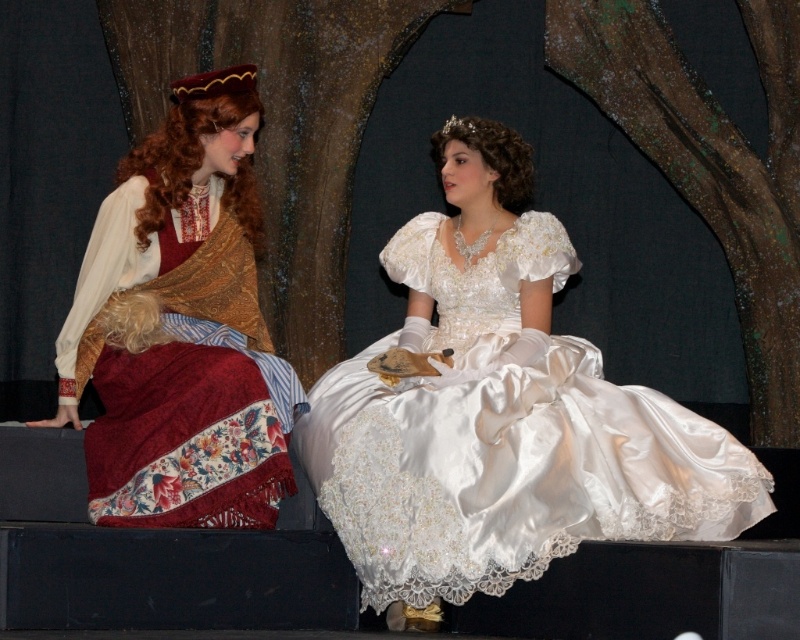
Question: Which of the following is the farthest from the observer?

Choices:
 (A) (448, 404)
 (B) (178, 502)

Answer: (B)

Question: Is satin/embroidered dress at center wider than matte gold shawl at left?

Choices:
 (A) no
 (B) yes

Answer: (B)

Question: Does satin/embroidered dress at center appear on the left side of matte gold shawl at left?

Choices:
 (A) yes
 (B) no

Answer: (B)

Question: Which of the following is the farthest from the observer?

Choices:
 (A) matte gold shawl at left
 (B) satin/embroidered dress at center

Answer: (A)

Question: In this image, where is satin/embroidered dress at center located relative to matte gold shawl at left?

Choices:
 (A) left
 (B) right

Answer: (B)